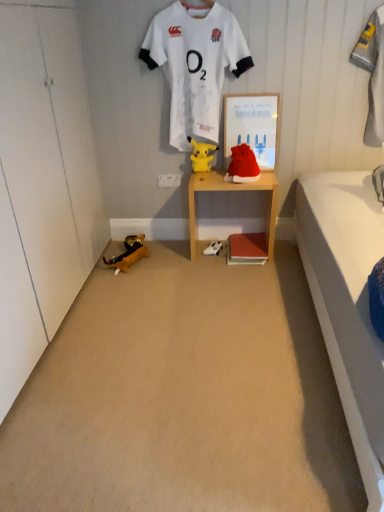
Where is `free point above white paper at center (from a real-world perspective)`? free point above white paper at center (from a real-world perspective) is located at coordinates (258, 87).